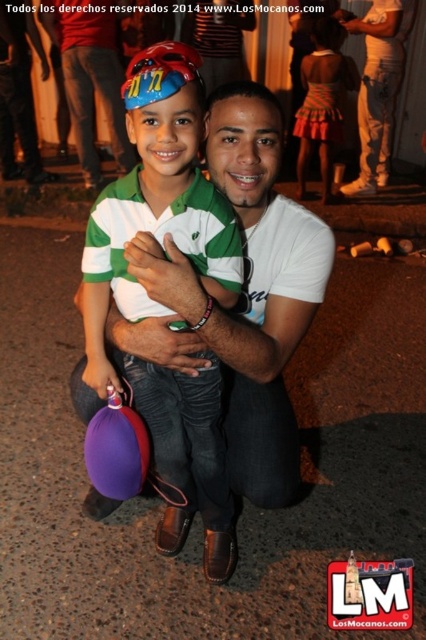
Question: Does green matte shirt at center come behind striped fabric dress at upper right?

Choices:
 (A) no
 (B) yes

Answer: (A)

Question: Is green matte shirt at center positioned at the back of purple rubber balloon at lower left?

Choices:
 (A) no
 (B) yes

Answer: (A)

Question: Which point appears farthest from the camera in this image?

Choices:
 (A) (126, 195)
 (B) (138, 474)
 (C) (356, 26)
 (D) (354, 65)

Answer: (D)

Question: Considering the real-world distances, which object is farthest from the green matte shirt at center?

Choices:
 (A) white matte shirt at center
 (B) purple rubber balloon at lower left
 (C) striped fabric dress at upper right

Answer: (A)

Question: Is white matte shirt at center wider than striped fabric dress at upper right?

Choices:
 (A) no
 (B) yes

Answer: (B)

Question: Among these objects, which one is nearest to the camera?

Choices:
 (A) green matte shirt at center
 (B) striped fabric dress at upper right

Answer: (A)